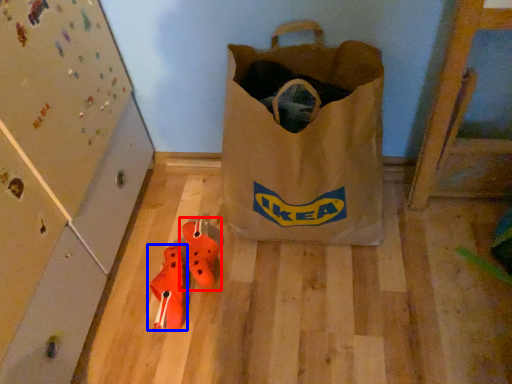
Question: Which point is closer to the camera, footwear (highlighted by a red box) or footwear (highlighted by a blue box)?

Choices:
 (A) footwear
 (B) footwear

Answer: (B)